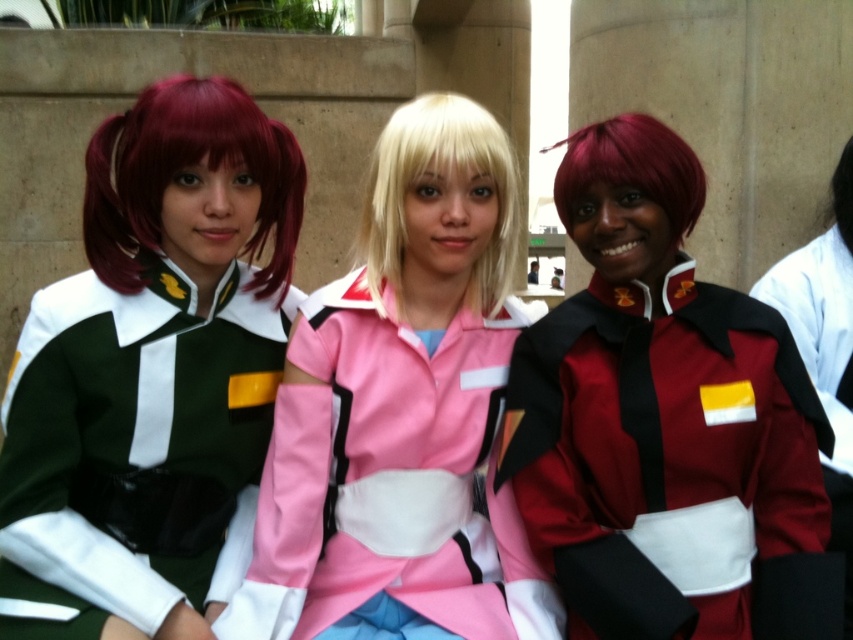
You are organizing a photoshoot and need to arrange the three cosplayers in a line. The requirement is that the person wearing the matte green uniform at left must be positioned so that they are not blocking the view of the blonde silky hair at center. Given their sizes, is this arrangement possible?

The matte green uniform at left is bigger than the blonde silky hair at center, so arranging them in a line where the larger matte green uniform at left is placed behind the smaller blonde silky hair at center would ensure the blonde silky hair at center remains visible. Alternatively, placing the matte green uniform at left to the side of the blonde silky hair at center while maintaining enough distance could also work.

You are a photographer at the event and need to position the two models with blonde silky hair at center and shiny burgundy wig at center so that their hair does not overlap in the photo. Which model should be placed further back to prevent overlap?

To prevent overlap between the blonde silky hair at center and the shiny burgundy wig at center, the shiny burgundy wig at center should be placed further back since it is larger and less likely to block the smaller blonde silky hair at center when positioned behind.